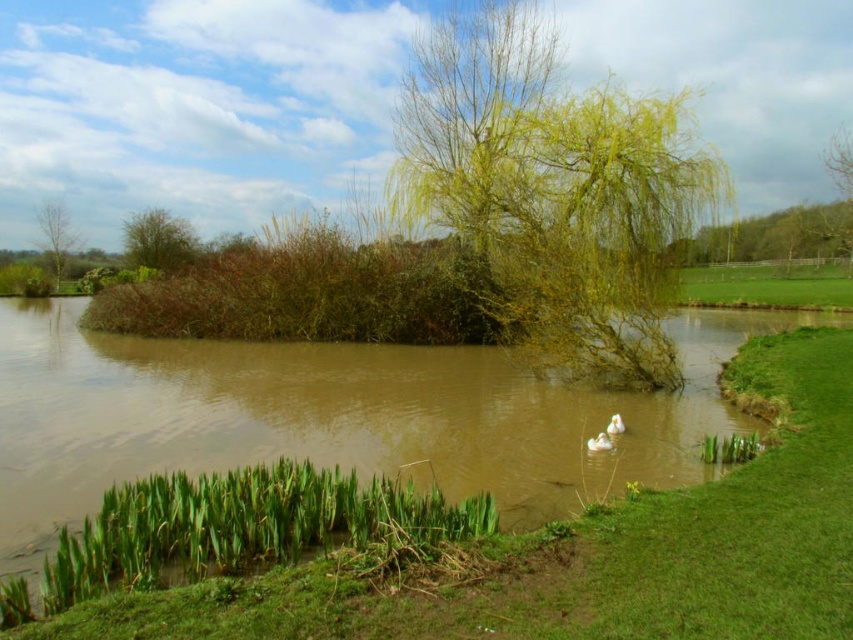
You are standing at the center of the grassy area near the pond. You want to walk to the green leafy bush at upper left marked by point (160, 241). Is there a clear path from your current position to the bush without crossing the water?

The point (160, 241) marks the green leafy bush at upper left, which is located on the grassy area near the edge of the water. Since the grassy area is part of the land, there should be a clear path to the bush without crossing the water.

You are a photographer trying to capture the green leafy willow at center and the white fluffy goose at center in the same frame. Which object will appear wider in your photo?

The green leafy willow at center will appear wider in the photo since its width surpasses that of the white fluffy goose at center.

You are standing at the edge of the pond and want to reach the point marked as point (840, 436) in the middle of the pond. If your maximum walking distance is 25 feet, can you safely reach that point without getting wet?

The point (840, 436) is 26.50 feet away from the viewer. Since your maximum walking distance is 25 feet, you cannot safely reach that point without getting wet.